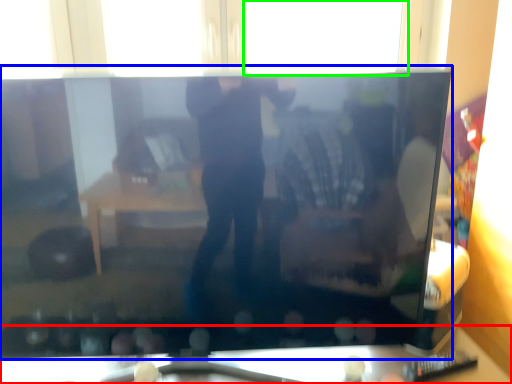
Question: Estimate the real-world distances between objects in this image. Which object is farther from furniture (highlighted by a red box), television (highlighted by a blue box) or window (highlighted by a green box)?

Choices:
 (A) television
 (B) window

Answer: (B)